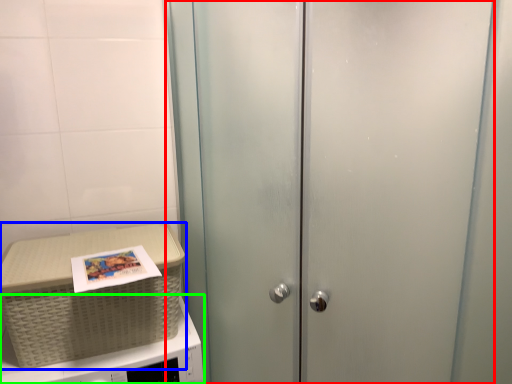
Question: Which object is positioned farthest from door (highlighted by a red box)? Select from picnic basket (highlighted by a blue box) and microwave oven (highlighted by a green box).

Choices:
 (A) picnic basket
 (B) microwave oven

Answer: (B)